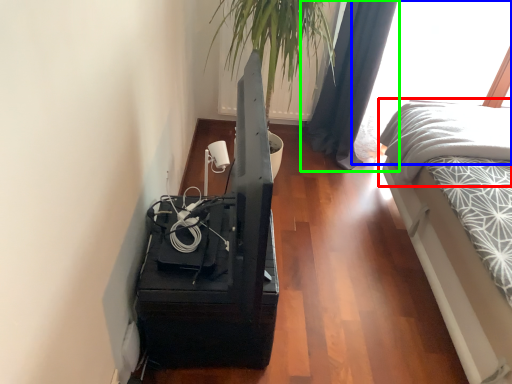
Question: Which object is the closest to the bedding (highlighted by a red box)? Choose among these: window (highlighted by a blue box) or curtain (highlighted by a green box).

Choices:
 (A) window
 (B) curtain

Answer: (B)